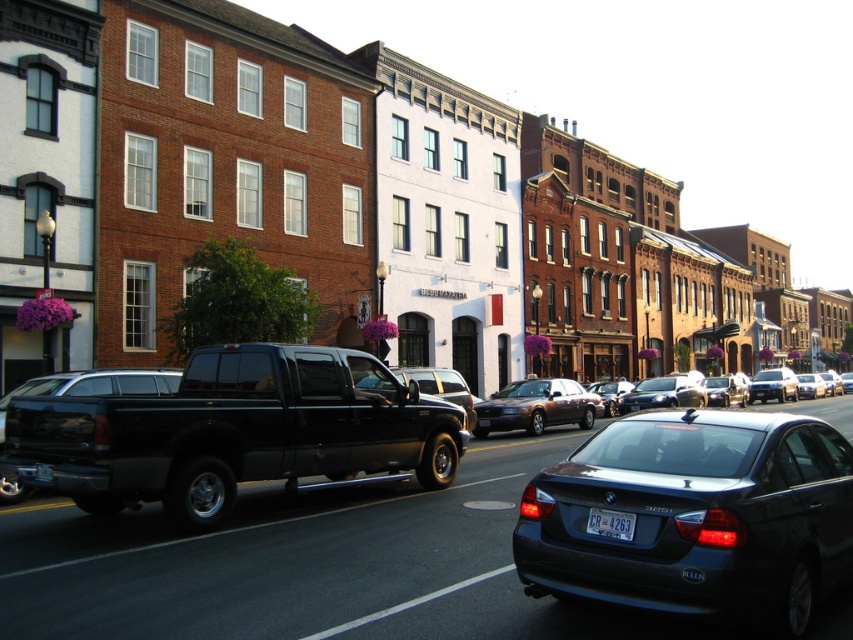
What is located at the point with coordinates (233, 432) in the image?

The point at coordinates (233, 432) is occupied by the black matte truck at center.

You are a delivery driver who needs to park your vehicle in a narrow alley that can only accommodate vehicles up to 2 meters wide. You have a choice between the black matte truck at center and the metallic brown sedan at center. Which vehicle should you choose to ensure it fits in the alley?

The metallic brown sedan at center should be chosen because the black matte truck at center is wider, so the sedan will fit better in the 2 meter wide alley.